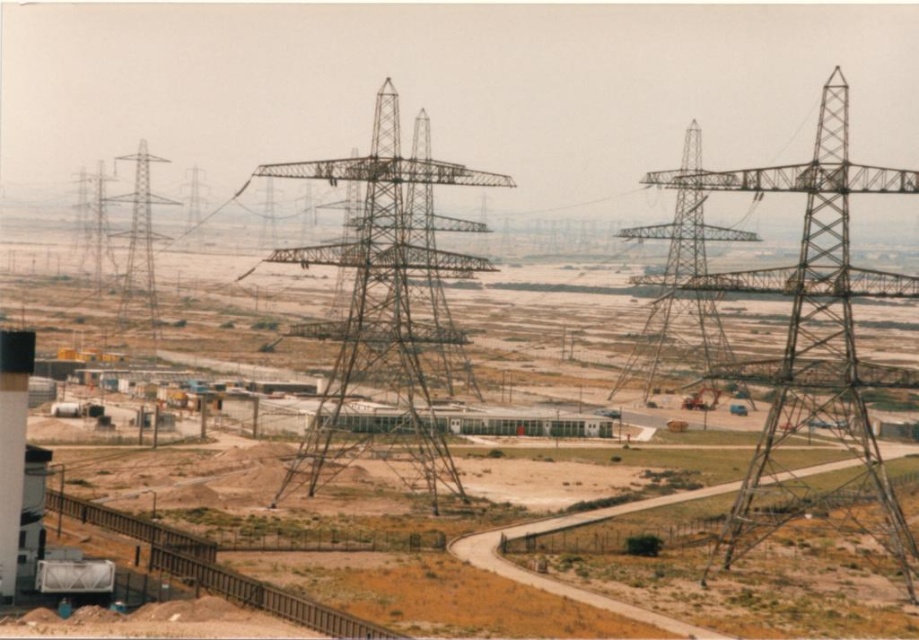
Which is in front, point (342, 420) or point (125, 308)?

Positioned in front is point (342, 420).

Can you confirm if green metallic tower at center is bigger than metallic gray tower at left?

Yes.

Does point (359, 292) lie in front of point (129, 243)?

Yes, it is in front of point (129, 243).

The height and width of the screenshot is (640, 919). What are the coordinates of `green metallic tower at center` in the screenshot? It's located at (380, 320).

Can you confirm if metallic structure at center is positioned to the left of metallic gray tower at left?

In fact, metallic structure at center is to the right of metallic gray tower at left.

This screenshot has height=640, width=919. Identify the location of metallic structure at center. (815, 352).

Which is behind, point (841, 355) or point (383, 294)?

Point (841, 355)

Find the location of a particular element. metallic structure at center is located at coordinates (815, 352).